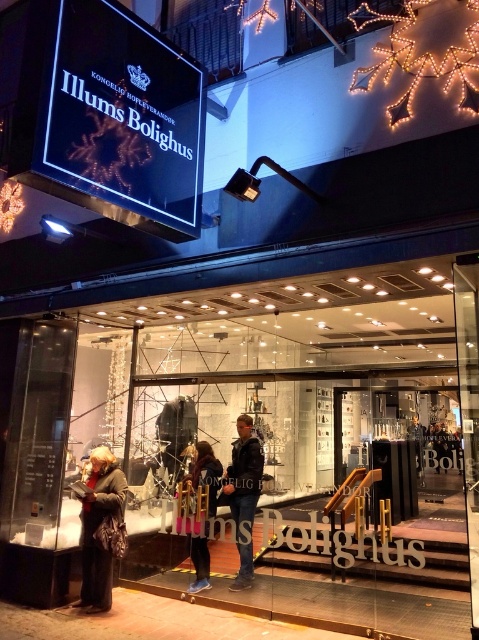
You are standing in front of the Illums Bolighus store at night. You see dark blue jeans at center. Where exactly are the dark blue jeans located in the store?

The dark blue jeans at center are located at point [243,493].

You are standing in front of the Illums Bolighus storefront at night. You see a leather jacket at lower left. Where exactly is the leather jacket positioned relative to the entrance?

The leather jacket at lower left is located at point (101, 529), which places it near the lower left corner of the entrance area.

You are standing in front of the Illums Bolighus store entrance. You see dark blue jeans at center and a denim jacket at center. Which clothing item is closer to you?

The dark blue jeans at center is closer to you because it is in front of the denim jacket at center.